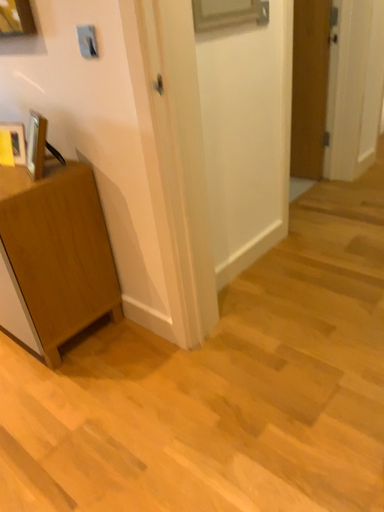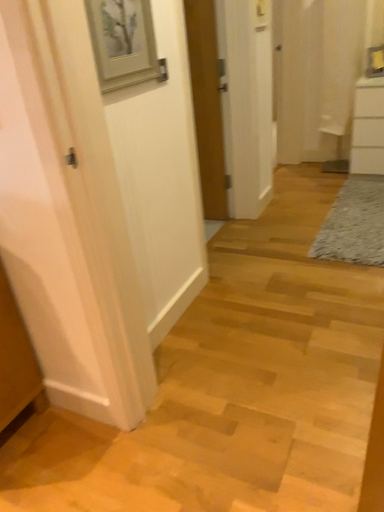
Question: How did the camera likely rotate when shooting the video?

Choices:
 (A) rotated left
 (B) rotated right

Answer: (B)